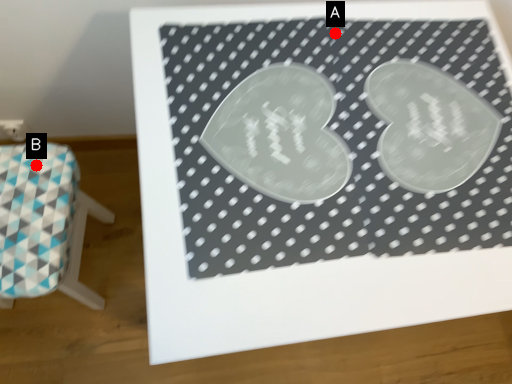
Question: Two points are circled on the image, labeled by A and B beside each circle. Which point is farther to the camera?

Choices:
 (A) A is further
 (B) B is further

Answer: (B)